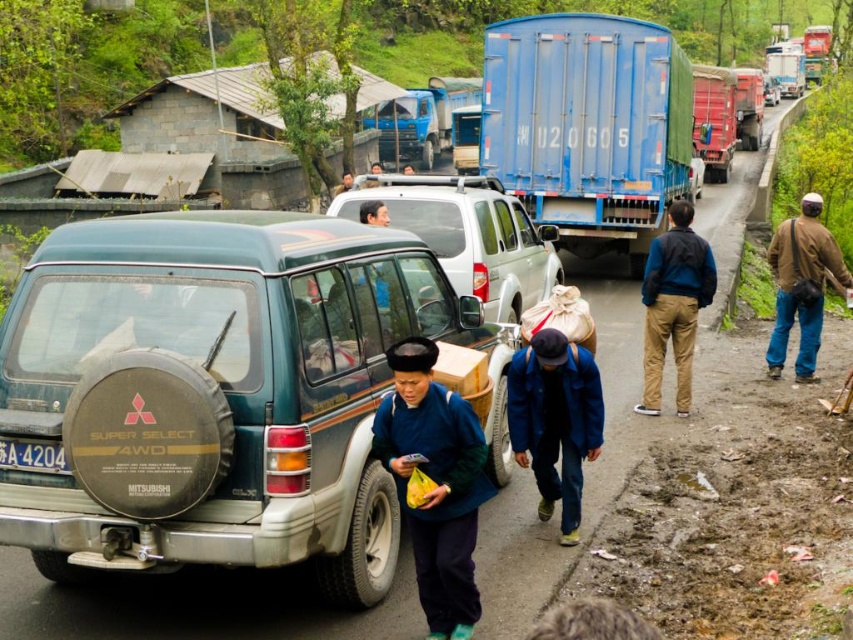
You are a pedestrian standing on the roadside and see the blue cotton jacket at center and the silver metallic minivan at center. Which object is taller?

The blue cotton jacket at center is taller than the silver metallic minivan at center.